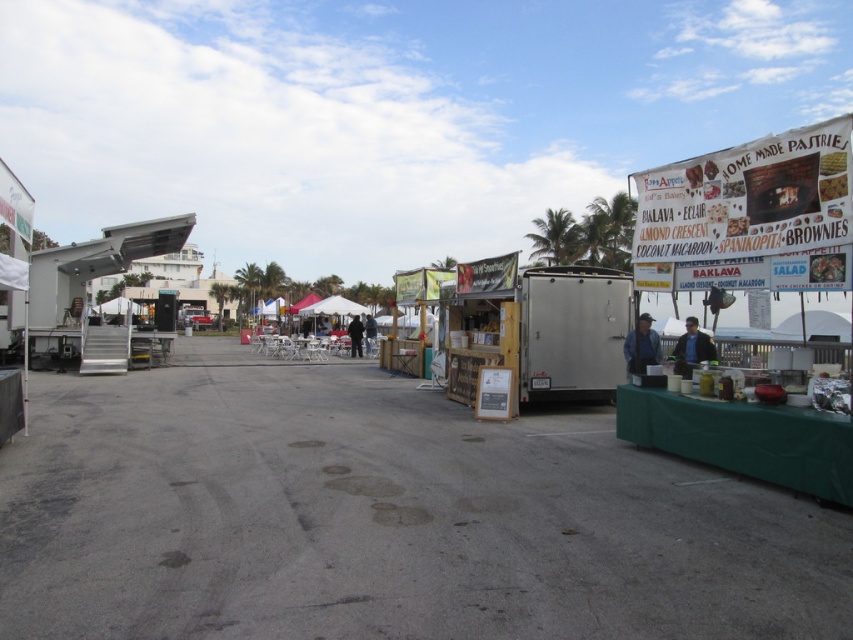
Does blue fabric vendor at right appear on the left side of black leather jacket at right?

Indeed, blue fabric vendor at right is positioned on the left side of black leather jacket at right.

Is point (639, 316) more distant than point (680, 362)?

That is True.

Find the location of `blue fabric vendor at right`. blue fabric vendor at right is located at coordinates (641, 346).

Describe the element at coordinates (540, 332) in the screenshot. This screenshot has width=853, height=640. I see `silver metallic food truck at center` at that location.

Can you confirm if silver metallic food truck at center is bigger than white fabric canopy at center?

No.

Is point (480, 333) closer to viewer compared to point (331, 308)?

Yes, it is.

This screenshot has width=853, height=640. In order to click on silver metallic food truck at center in this screenshot , I will do `click(540, 332)`.

Which of these two, blue fabric vendor at right or white fabric canopy at center, stands taller?

white fabric canopy at center

Where is `blue fabric vendor at right`? This screenshot has width=853, height=640. blue fabric vendor at right is located at coordinates (641, 346).